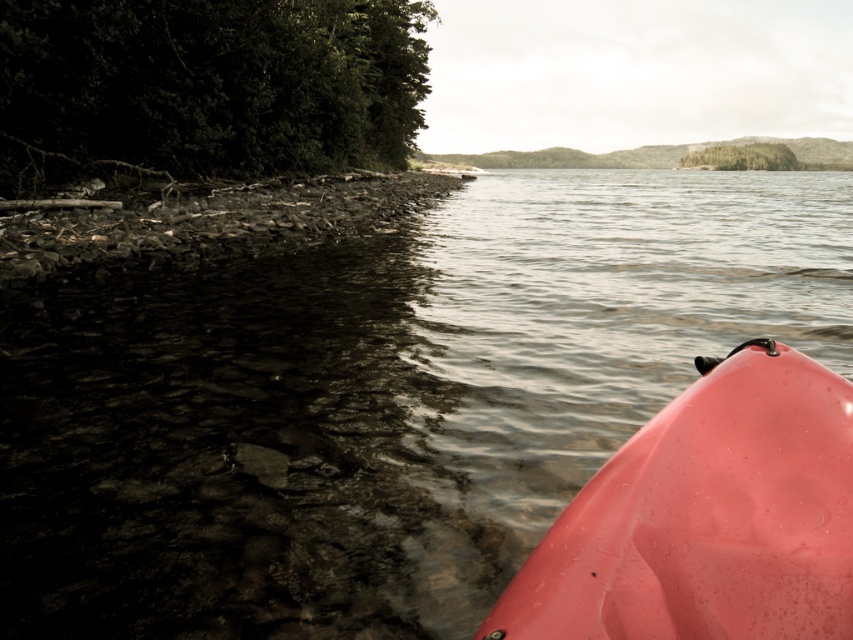
What do you see at coordinates (706, 516) in the screenshot? Image resolution: width=853 pixels, height=640 pixels. I see `glossy plastic kayak at lower right` at bounding box center [706, 516].

Identify the location of glossy plastic kayak at lower right. Image resolution: width=853 pixels, height=640 pixels. (706, 516).

Describe the element at coordinates (706, 516) in the screenshot. The height and width of the screenshot is (640, 853). I see `glossy plastic kayak at lower right` at that location.

Locate an element on the screen. The width and height of the screenshot is (853, 640). glossy plastic kayak at lower right is located at coordinates (706, 516).

Between point (74, 385) and point (219, 193), which one is positioned behind?

The point (219, 193) is more distant.

This screenshot has height=640, width=853. Identify the location of transparent water at lower right. (380, 400).

Image resolution: width=853 pixels, height=640 pixels. Describe the element at coordinates (380, 400) in the screenshot. I see `transparent water at lower right` at that location.

The image size is (853, 640). What are the coordinates of `transparent water at lower right` in the screenshot? It's located at (380, 400).

Who is taller, green leafy tree at upper left or rough stone shore at left?

green leafy tree at upper left is taller.

Who is more distant from viewer, (x=392, y=147) or (x=315, y=193)?

The point (x=392, y=147) is behind.

Between point (354, 161) and point (270, 228), which one is positioned in front?

Point (270, 228) is more forward.

Find the location of a particular element. This screenshot has height=640, width=853. green leafy tree at upper left is located at coordinates (207, 84).